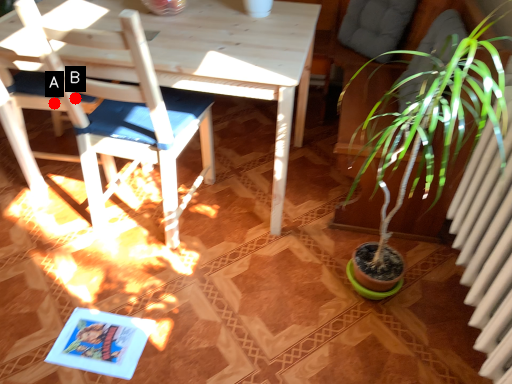
Question: Two points are circled on the image, labeled by A and B beside each circle. Which point appears closest to the camera in this image?

Choices:
 (A) A is closer
 (B) B is closer

Answer: (B)